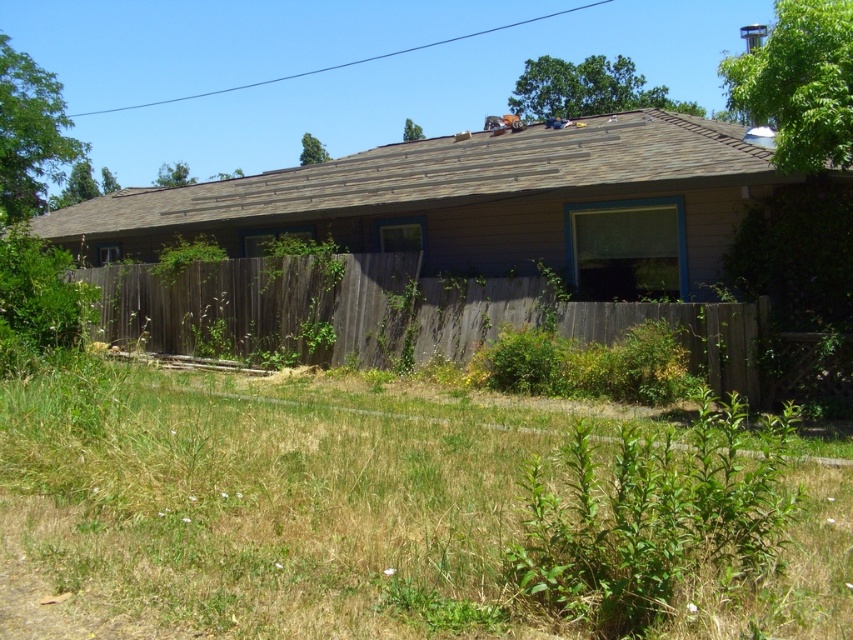
You are standing at the center of the backyard and want to walk towards the green grass at lower center. Based on the coordinates provided, in which direction should you move relative to your current position?

The green grass at lower center is located at coordinates point (270, 500), so you should move towards the lower center direction relative to your current position.

You are a gardener who wants to plant a new flower bed between the green grass at lower center and the wooden fence in the middle. The flower bed requires a space of 3 meters. Is there enough space between them?

The distance between the green grass at lower center and the wooden fence in the middle is 3.29 meters, which is more than the required 3 meters. Therefore, there is sufficient space to plant the flower bed.